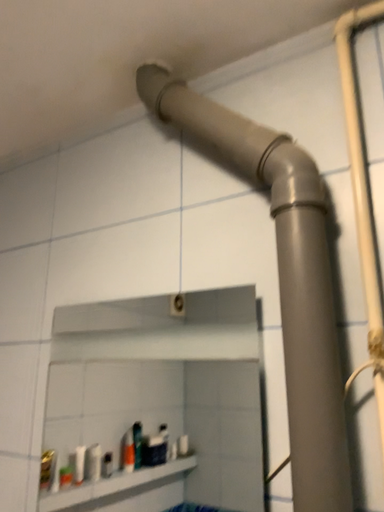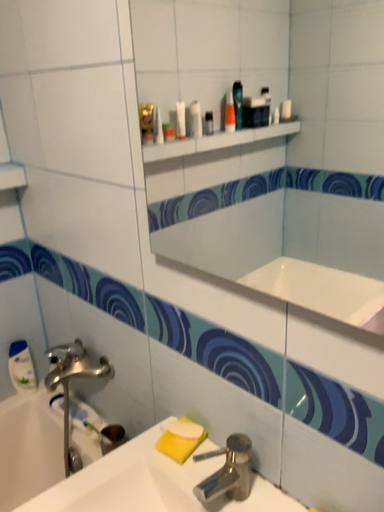
Question: Which way did the camera rotate in the video?

Choices:
 (A) rotated upward
 (B) rotated downward

Answer: (B)